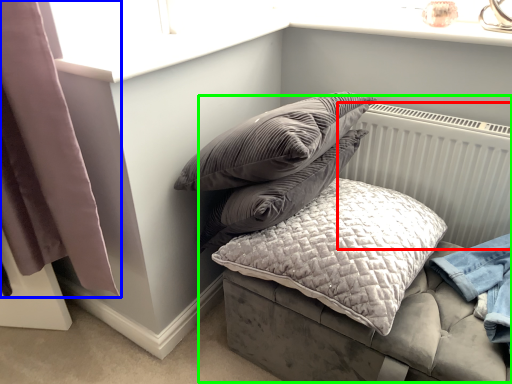
Question: Considering the real-world distances, which object is farthest from radiator (highlighted by a red box)? curtain (highlighted by a blue box) or bed (highlighted by a green box)?

Choices:
 (A) curtain
 (B) bed

Answer: (A)